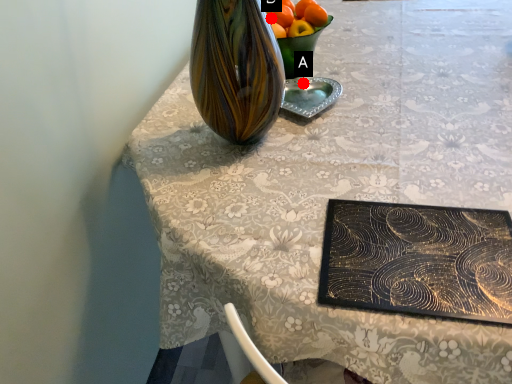
Question: Two points are circled on the image, labeled by A and B beside each circle. Which point is closer to the camera taking this photo?

Choices:
 (A) A is closer
 (B) B is closer

Answer: (B)